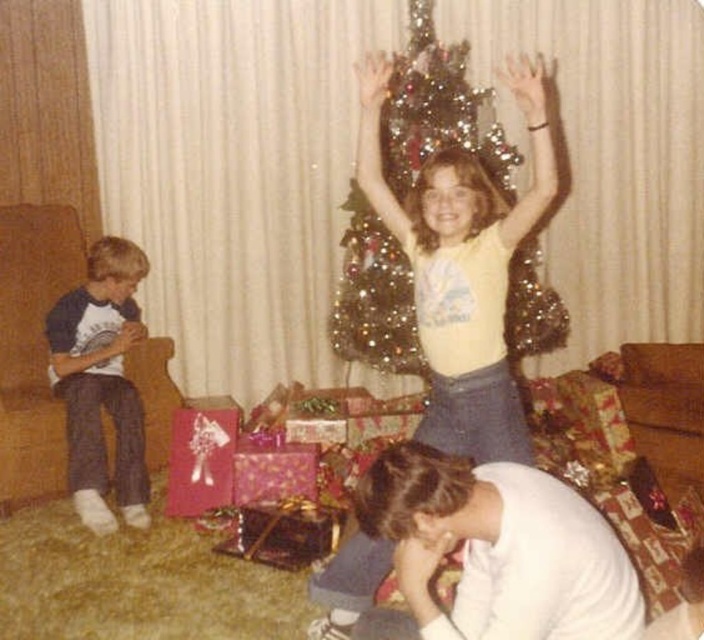
Between white soft shirt at lower center and dark blue cotton shirt at left, which one appears on the left side from the viewer's perspective?

From the viewer's perspective, dark blue cotton shirt at left appears more on the left side.

Is point (529, 621) more distant than point (77, 483)?

No, (529, 621) is in front of (77, 483).

At what (x,y) coordinates should I click in order to perform the action: click on white soft shirt at lower center. Please return your answer as a coordinate pair (x, y). The width and height of the screenshot is (704, 640). Looking at the image, I should click on (498, 548).

Which is in front, point (458, 627) or point (491, 157)?

Positioned in front is point (458, 627).

How distant is white soft shirt at lower center from shiny metallic tree at center?

white soft shirt at lower center and shiny metallic tree at center are 6.63 feet apart from each other.

Is point (425, 540) farther from viewer compared to point (379, 282)?

No.

What are the coordinates of `white soft shirt at lower center` in the screenshot? It's located at (498, 548).

From the picture: Is the position of shiny metallic tree at center more distant than that of shiny metallic gift at lower center?

Yes, shiny metallic tree at center is behind shiny metallic gift at lower center.

Is point (367, 314) in front of point (257, 547)?

No, it is behind (257, 547).

You are a GUI agent. You are given a task and a screenshot of the screen. Output one action in this format:
    pyautogui.click(x=<x>, y=<y>)
    Task: Click on the shiny metallic tree at center
    This screenshot has height=640, width=704.
    Given the screenshot: What is the action you would take?
    pyautogui.click(x=439, y=109)